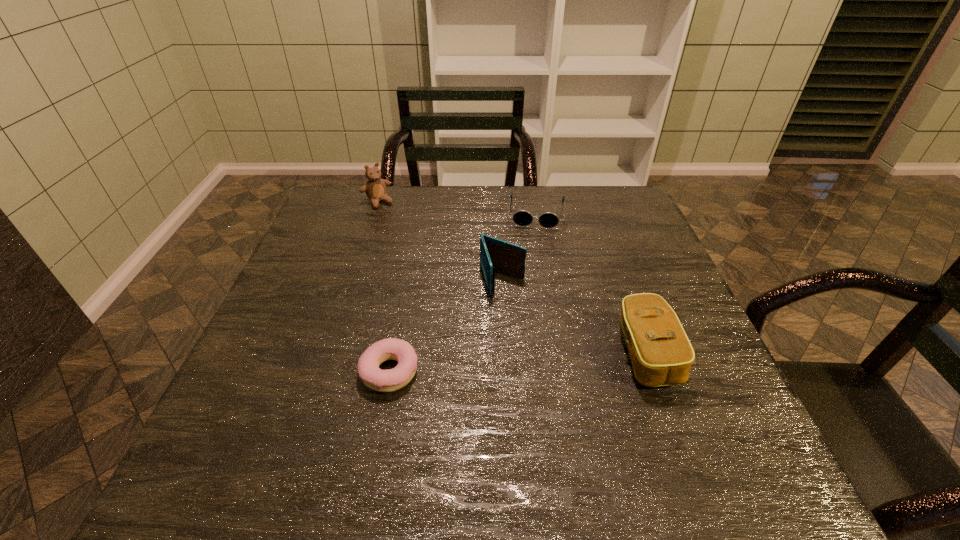
Identify the location of free region located 0.390m on the front-facing side of the sunglasses. (527, 333).

The image size is (960, 540). Identify the location of vacant space situated on the front-facing side of the sunglasses. (527, 336).

Identify the location of free spot located 0.190m on the front-facing side of the sunglasses. (532, 273).

Find the location of a particular element. vacant space located 0.240m on the exterior surface of the third nearest object is located at coordinates (538, 380).

Locate an element on the screen. vacant position located on the exterior surface of the third nearest object is located at coordinates (539, 384).

Locate an element on the screen. The width and height of the screenshot is (960, 540). vacant space located 0.100m on the exterior surface of the third nearest object is located at coordinates (518, 328).

Where is `teddy bear that is at the far edge`? teddy bear that is at the far edge is located at coordinates [x=375, y=189].

You are a GUI agent. You are given a task and a screenshot of the screen. Output one action in this format:
    pyautogui.click(x=<x>, y=<y>)
    Task: Click on the sunglasses situated at the far edge
    
    Given the screenshot: What is the action you would take?
    pyautogui.click(x=521, y=217)

The image size is (960, 540). I want to click on object located at the near edge, so pyautogui.click(x=390, y=380).

The image size is (960, 540). Identify the location of object at the left edge. (375, 189).